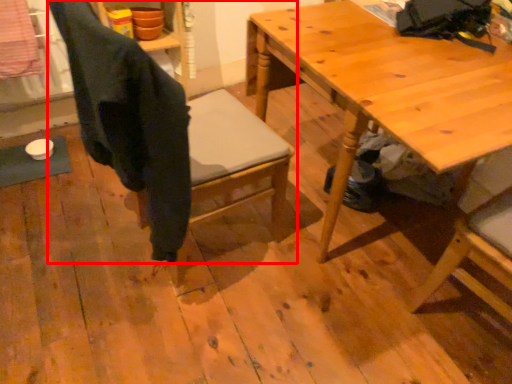
Question: From the image's perspective, where is chair (annotated by the red box) located in relation to table in the image?

Choices:
 (A) below
 (B) above

Answer: (A)